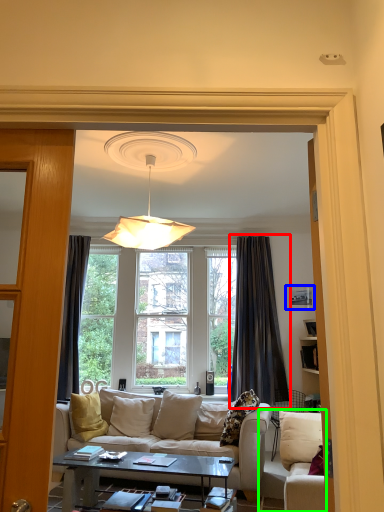
Question: Based on their relative distances, which object is farther from curtain (highlighted by a red box)? Choose from picture frame (highlighted by a blue box) and studio couch (highlighted by a green box).

Choices:
 (A) picture frame
 (B) studio couch

Answer: (B)